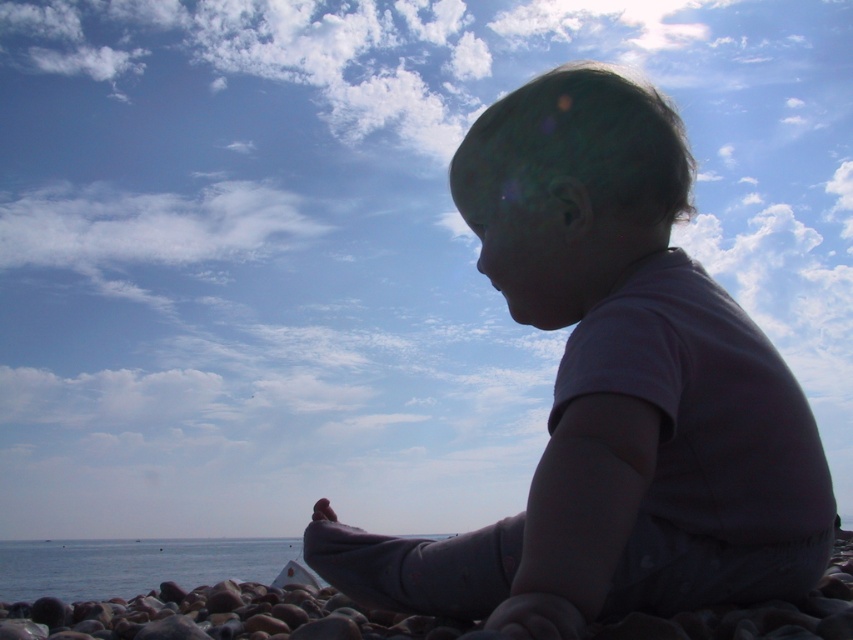
You are standing on the beach and see two points in the scene. The first point is at coordinates point [689,280] and the second is at point [67,566]. Which point is nearer to you?

Point [689,280] is closer to the viewer than point [67,566].

You are a photographer planning to capture the purple cotton baby at center and the blue water at lower left in a single frame. Given that the camera can only accommodate objects with a maximum width of 10 units, can both objects fit side by side without overlapping?

The purple cotton baby at center has a smaller width than the blue water at lower left. However, since the total width of both objects combined exceeds the camera frame limit of 10 units, they cannot fit side by side without overlapping.